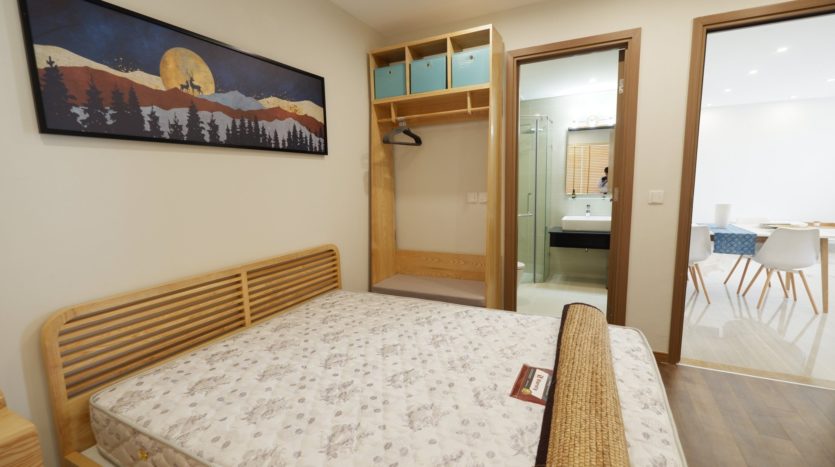
The height and width of the screenshot is (467, 835). What are the coordinates of `bathroom floor` in the screenshot? It's located at (555, 294).